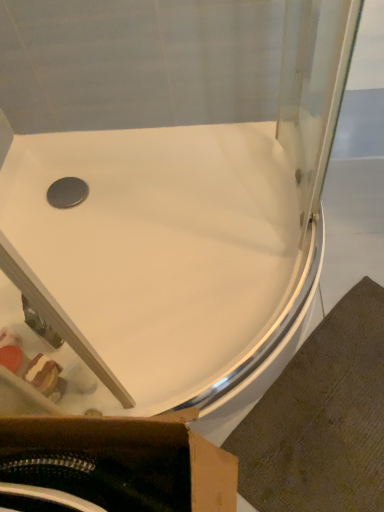
Describe the element at coordinates (160, 266) in the screenshot. I see `white glossy sink at center` at that location.

This screenshot has width=384, height=512. What are the coordinates of `white glossy sink at center` in the screenshot? It's located at (160, 266).

Locate an element on the screen. This screenshot has width=384, height=512. white glossy sink at center is located at coordinates (160, 266).